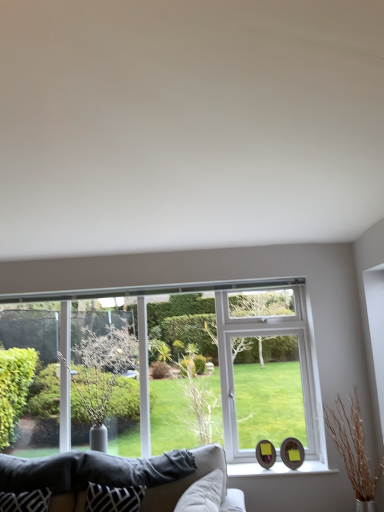
Question: Can you confirm if green leafy tree at left is positioned to the left of velvet beige couch at lower center?

Choices:
 (A) no
 (B) yes

Answer: (B)

Question: From the image's perspective, is green leafy tree at left on velvet beige couch at lower center?

Choices:
 (A) no
 (B) yes

Answer: (B)

Question: Does green leafy tree at left have a larger size compared to velvet beige couch at lower center?

Choices:
 (A) yes
 (B) no

Answer: (B)

Question: Considering the relative positions of green leafy tree at left and velvet beige couch at lower center in the image provided, is green leafy tree at left to the right of velvet beige couch at lower center from the viewer's perspective?

Choices:
 (A) no
 (B) yes

Answer: (A)

Question: Does green leafy tree at left have a lesser width compared to velvet beige couch at lower center?

Choices:
 (A) no
 (B) yes

Answer: (B)

Question: Do you think white glossy window sill at lower center is within blue and white fabric pillow at lower center, or outside of it?

Choices:
 (A) outside
 (B) inside

Answer: (A)

Question: Considering the positions of white glossy window sill at lower center and blue and white fabric pillow at lower center in the image, is white glossy window sill at lower center wider or thinner than blue and white fabric pillow at lower center?

Choices:
 (A) thin
 (B) wide

Answer: (B)

Question: From the image's perspective, is white glossy window sill at lower center above or below blue and white fabric pillow at lower center?

Choices:
 (A) above
 (B) below

Answer: (B)

Question: In terms of height, does white glossy window sill at lower center look taller or shorter compared to blue and white fabric pillow at lower center?

Choices:
 (A) tall
 (B) short

Answer: (B)

Question: From their relative heights in the image, would you say green leafy tree at left is taller or shorter than blue and white fabric pillow at lower center?

Choices:
 (A) tall
 (B) short

Answer: (A)

Question: From the image's perspective, is green leafy tree at left above or below blue and white fabric pillow at lower center?

Choices:
 (A) below
 (B) above

Answer: (B)

Question: Is green leafy tree at left spatially inside blue and white fabric pillow at lower center, or outside of it?

Choices:
 (A) outside
 (B) inside

Answer: (A)

Question: Considering the positions of green leafy tree at left and blue and white fabric pillow at lower center in the image, is green leafy tree at left wider or thinner than blue and white fabric pillow at lower center?

Choices:
 (A) wide
 (B) thin

Answer: (A)

Question: Which is correct: velvet beige couch at lower center is inside blue and white fabric pillow at lower center, or outside of it?

Choices:
 (A) outside
 (B) inside

Answer: (A)

Question: Is point (148, 501) closer or farther from the camera than point (139, 508)?

Choices:
 (A) farther
 (B) closer

Answer: (A)